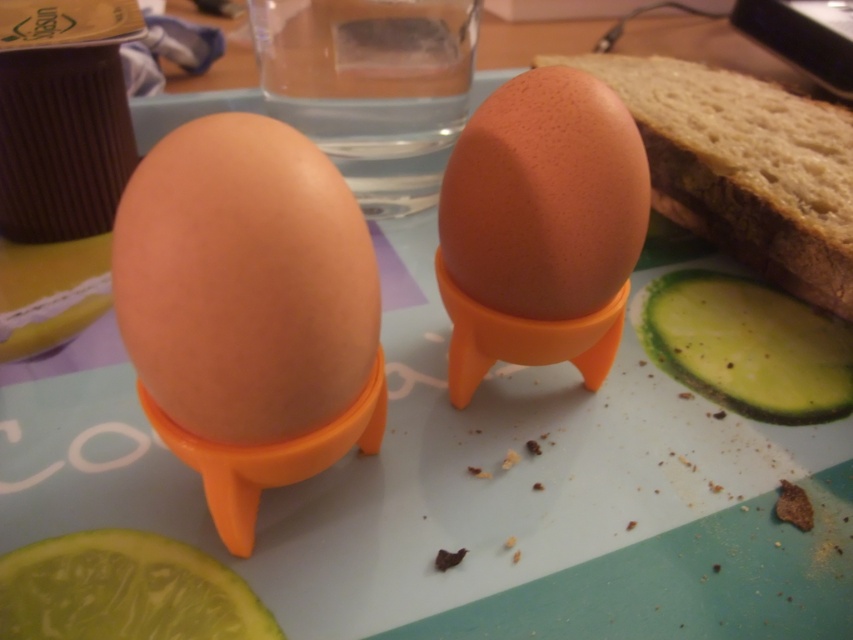
In the scene shown: You are organizing a breakfast tray and need to arrange the matte brown egg at center and the brown matte egg at center based on their sizes. Which egg should you place first if you want to start with the smaller one?

The matte brown egg at center has a lesser width compared to the brown matte egg at center, so you should place the matte brown egg at center first since it is smaller.

You are preparing a meal and have both the brown matte egg at center and the green matte pickle at lower left on your plate. If you want to serve the larger item first, which one should you pick?

The brown matte egg at center is larger in size than the green matte pickle at lower left, so you should pick the brown matte egg at center first.